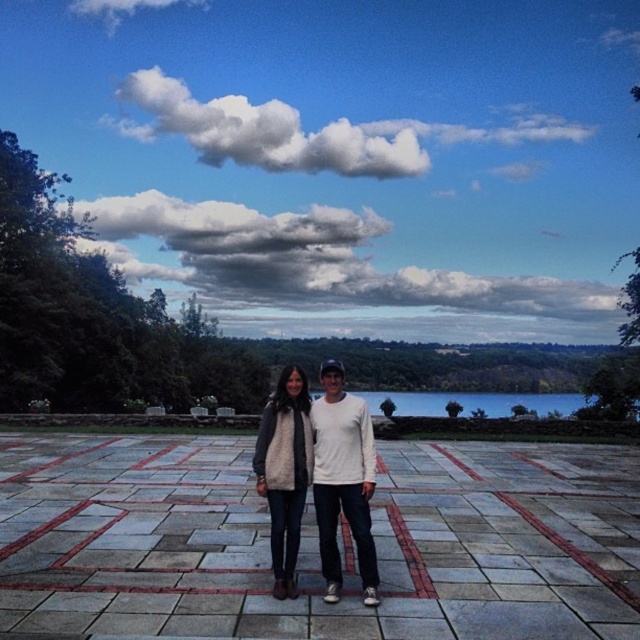
You are a fashion designer observing two garments in the scene. The white knit sweater at center and the fuzzy white vest at center. Which garment appears shorter in height?

The white knit sweater at center has a lesser height compared to the fuzzy white vest at center, so the white knit sweater at center appears shorter.

You are standing in the outdoor scene and want to reach the point marked at coordinates point (438, 269). If you walk directly towards it, how far will you have to walk?

The point (438, 269) is 96.24 meters away from the viewer, so you will have to walk 96.24 meters to reach it.